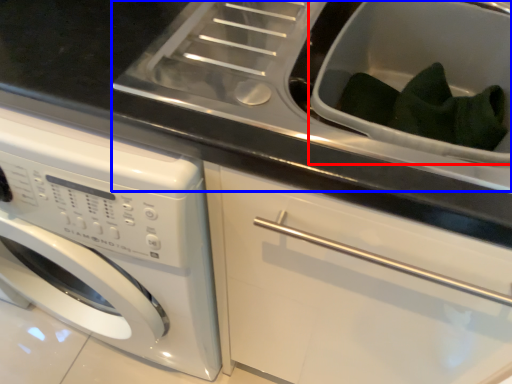
Question: Among these objects, which one is farthest to the camera, sink (highlighted by a red box) or sink (highlighted by a blue box)?

Choices:
 (A) sink
 (B) sink

Answer: (A)